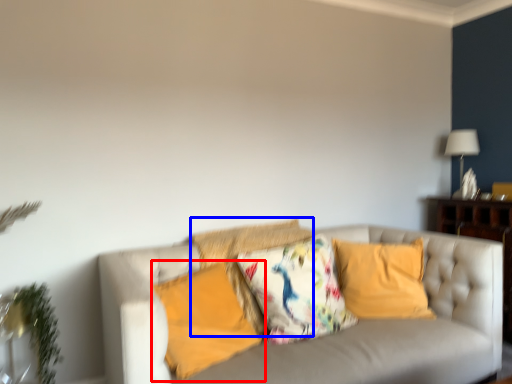
Question: Which of the following is the farthest to the observer, pillow (highlighted by a red box) or pillow (highlighted by a blue box)?

Choices:
 (A) pillow
 (B) pillow

Answer: (B)